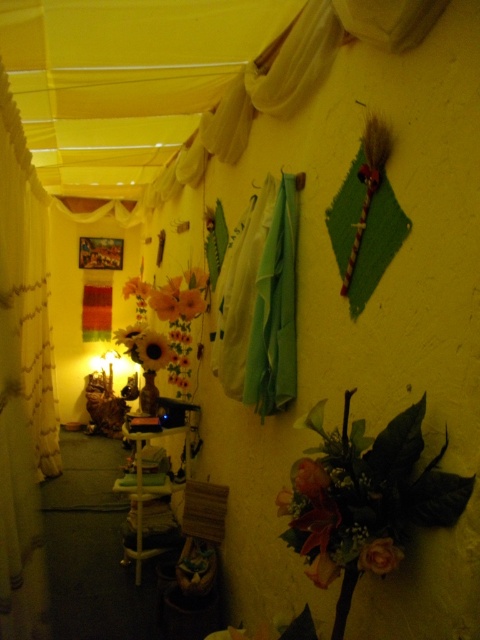
Question: Which point appears farthest from the camera in this image?

Choices:
 (A) (147, 348)
 (B) (376, 548)
 (C) (322, 554)
 (D) (179, 372)

Answer: (D)

Question: Which point is closer to the camera?

Choices:
 (A) white sheer curtain at left
 (B) silky orange flower at lower right
 (C) matte orange flower at lower right
 (D) matte brown vase at center

Answer: (C)

Question: Does sunflower vase at center have a larger size compared to silky orange flower at lower right?

Choices:
 (A) yes
 (B) no

Answer: (A)

Question: Does matte brown vase at center have a smaller size compared to matte orange flower at lower right?

Choices:
 (A) yes
 (B) no

Answer: (B)

Question: Estimate the real-world distances between objects in this image. Which object is closer to the matte orange flower at lower right?

Choices:
 (A) white sheer curtain at left
 (B) matte brown vase at center
 (C) silky orange flower at lower right
 (D) sunflower vase at center

Answer: (C)

Question: Is sunflower vase at center below silky orange flower at lower right?

Choices:
 (A) yes
 (B) no

Answer: (B)